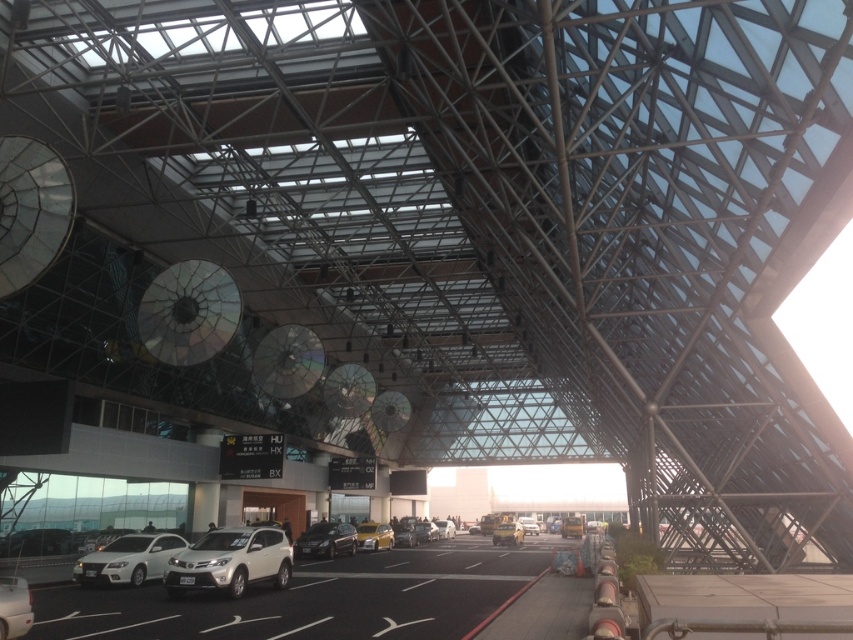
Question: Does white matte suv at center come in front of metallic silver sedan at center?

Choices:
 (A) no
 (B) yes

Answer: (B)

Question: Which object is farther from the camera taking this photo?

Choices:
 (A) black asphalt parking lot at center
 (B) white matte sedan at center

Answer: (B)

Question: Which point appears closest to the camera in this image?

Choices:
 (A) (531, 524)
 (B) (347, 552)
 (C) (453, 532)
 (D) (164, 556)

Answer: (D)

Question: Which is farther from the white matte sedan at center?

Choices:
 (A) yellow matte car at center
 (B) yellow metallic car at center
 (C) yellow metallic taxi at center

Answer: (C)

Question: Where is white matte suv at center located in relation to satin black sedan at center in the image?

Choices:
 (A) below
 (B) above

Answer: (B)

Question: Is satin black sedan at center closer to camera compared to yellow matte car at center?

Choices:
 (A) no
 (B) yes

Answer: (B)